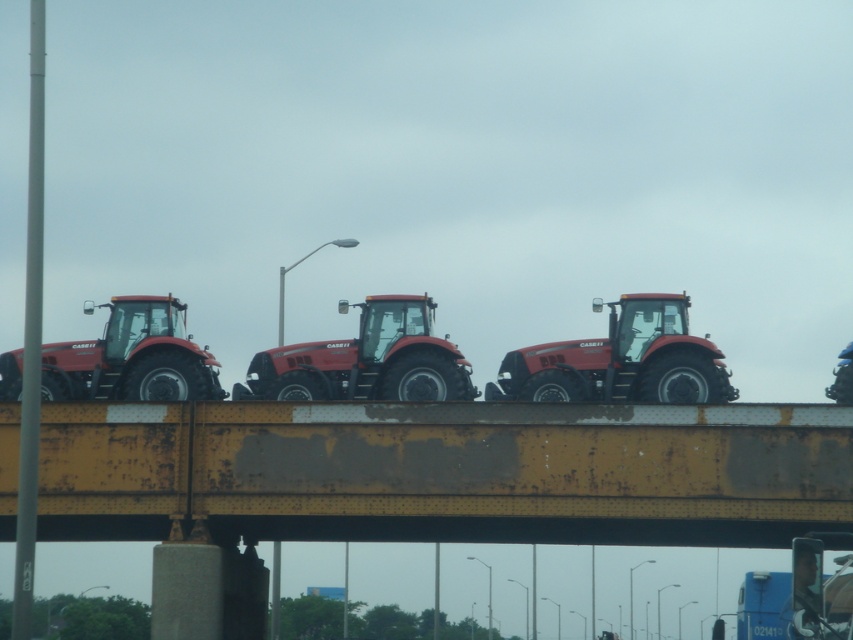
Does yellow rusted steel bridge at center have a larger size compared to matte black tractor at left?

Yes, yellow rusted steel bridge at center is bigger than matte black tractor at left.

Can you confirm if yellow rusted steel bridge at center is thinner than matte black tractor at left?

In fact, yellow rusted steel bridge at center might be wider than matte black tractor at left.

Which is in front, point (519, 445) or point (140, 344)?

Point (519, 445)

At what (x,y) coordinates should I click in order to perform the action: click on yellow rusted steel bridge at center. Please return your answer as a coordinate pair (x, y). This screenshot has width=853, height=640. Looking at the image, I should click on (445, 472).

Is point (517, 387) closer to camera compared to point (68, 362)?

Yes.

Which of these two, matte red tractor at center or matte black tractor at left, stands taller?

matte black tractor at left

Does point (651, 328) lie behind point (166, 333)?

Yes.

You are a GUI agent. You are given a task and a screenshot of the screen. Output one action in this format:
    pyautogui.click(x=<x>, y=<y>)
    Task: Click on the matte red tractor at center
    
    Given the screenshot: What is the action you would take?
    pyautogui.click(x=621, y=360)

In the scene shown: Is matte black tractor at center to the right of matte black tractor at left from the viewer's perspective?

Correct, you'll find matte black tractor at center to the right of matte black tractor at left.

What do you see at coordinates (366, 360) in the screenshot? I see `matte black tractor at center` at bounding box center [366, 360].

Where is `matte black tractor at center`? matte black tractor at center is located at coordinates click(366, 360).